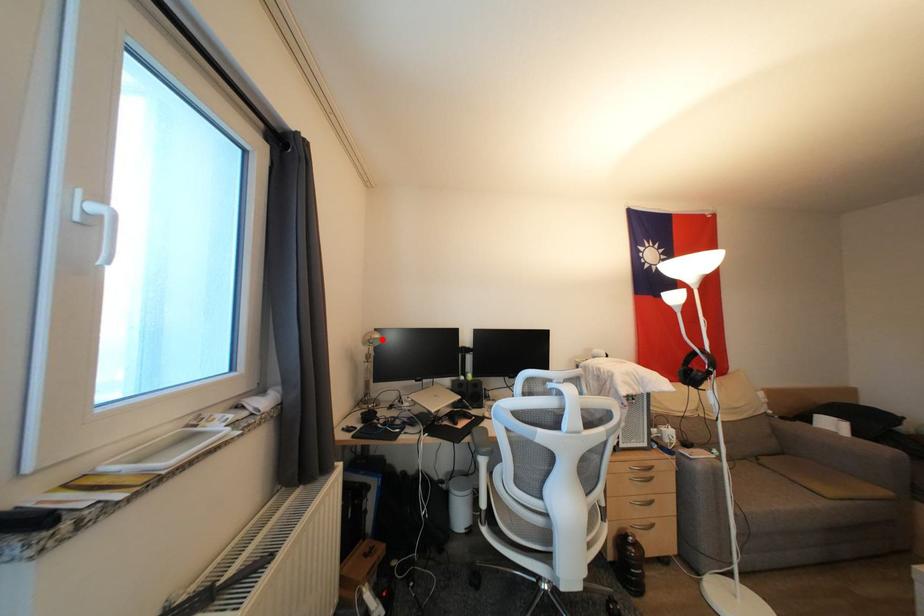
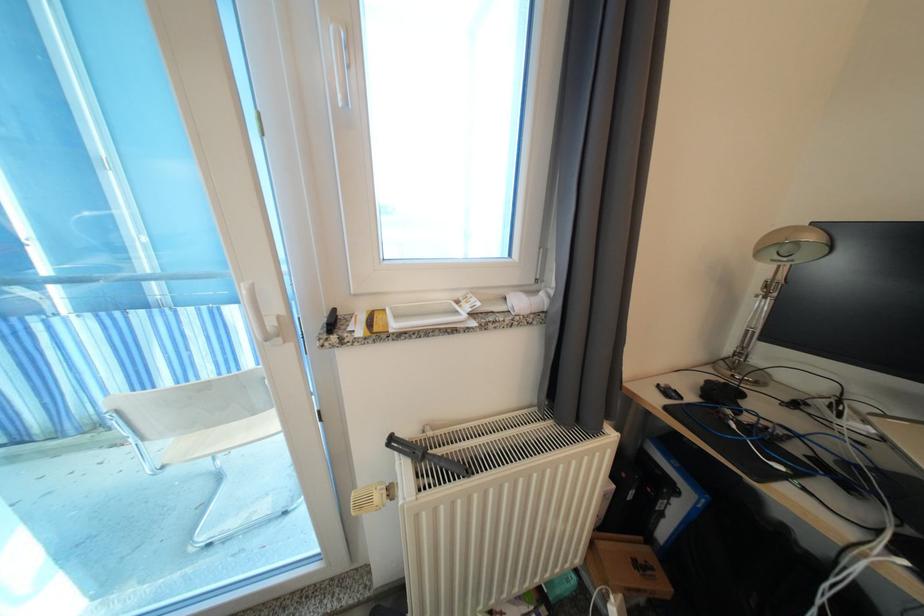
Question: I am providing you with two images of the same scene from different viewpoints. Image1 has a red point marked. In image2, the corresponding 3D location appears at what relative position? Reply with the corresponding letter.

Choices:
 (A) Closer
 (B) Farther

Answer: (B)